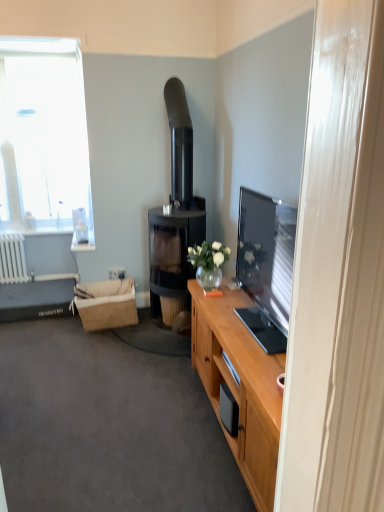
What do you see at coordinates (117, 273) in the screenshot?
I see `white plastic power outlet at lower left` at bounding box center [117, 273].

Locate an element on the screen. burlap picnic basket at lower left is located at coordinates (106, 304).

This screenshot has height=512, width=384. What do you see at coordinates (107, 426) in the screenshot? I see `wooden cabinet at lower right` at bounding box center [107, 426].

This screenshot has height=512, width=384. In order to click on white plastic power outlet at lower left in this screenshot , I will do `click(117, 273)`.

Between white plastic power outlet at lower left and wooden cabinet at lower right, which one has larger size?

wooden cabinet at lower right.

From the picture: From a real-world perspective, is white plastic power outlet at lower left positioned under wooden cabinet at lower right based on gravity?

No, from a real-world perspective, white plastic power outlet at lower left is not below wooden cabinet at lower right.

Is wooden cabinet at lower right at the back of white plastic power outlet at lower left?

No, white plastic power outlet at lower left's orientation is not away from wooden cabinet at lower right.

From the image's perspective, is white plastic power outlet at lower left located beneath burlap picnic basket at lower left?

Actually, white plastic power outlet at lower left appears above burlap picnic basket at lower left in the image.

Which is behind, white plastic power outlet at lower left or burlap picnic basket at lower left?

white plastic power outlet at lower left is further from the camera.

Is wooden cabinet at lower right positioned with its back to white glass window at upper left?

No, wooden cabinet at lower right is not facing away from white glass window at upper left.

Considering the relative positions of wooden cabinet at lower right and white glass window at upper left in the image provided, is wooden cabinet at lower right behind white glass window at upper left?

No, wooden cabinet at lower right is closer to the camera.

Would you consider wooden cabinet at lower right to be distant from white glass window at upper left?

wooden cabinet at lower right is far away from white glass window at upper left.

Can you confirm if white glass window at upper left is taller than black glass fireplace at center?

No.

Is white glass window at upper left to the left of black glass fireplace at center from the viewer's perspective?

Yes, white glass window at upper left is to the left of black glass fireplace at center.

Is point (81, 149) positioned behind point (185, 172)?

Yes, point (81, 149) is behind point (185, 172).

How many degrees apart are the facing directions of white glass window at upper left and black glass fireplace at center?

89.9 degrees separate the facing orientations of white glass window at upper left and black glass fireplace at center.

Can you confirm if white glass window at upper left is positioned to the left of white plastic power outlet at lower left?

Indeed, white glass window at upper left is positioned on the left side of white plastic power outlet at lower left.

Is white glass window at upper left wider than white plastic power outlet at lower left?

Indeed, white glass window at upper left has a greater width compared to white plastic power outlet at lower left.

Consider the image. From the image's perspective, between white glass window at upper left and white plastic power outlet at lower left, who is located below?

white plastic power outlet at lower left appears lower in the image.

How much distance is there between white glass window at upper left and white plastic power outlet at lower left?

white glass window at upper left is 1.56 meters away from white plastic power outlet at lower left.

Who is smaller, burlap picnic basket at lower left or white glass window at upper left?

With smaller size is burlap picnic basket at lower left.

In the image, there is a white glass window at upper left. Where is `picnic basket below it (from a real-world perspective)`? This screenshot has height=512, width=384. picnic basket below it (from a real-world perspective) is located at coordinates (106, 304).

Does burlap picnic basket at lower left appear on the right side of white glass window at upper left?

Yes, burlap picnic basket at lower left is to the right of white glass window at upper left.

Which is behind, point (114, 314) or point (15, 194)?

The point (15, 194) is farther.

Is wooden cabinet at lower right looking in the opposite direction of black glass fireplace at center?

No, wooden cabinet at lower right's orientation is not away from black glass fireplace at center.

Between wooden cabinet at lower right and black glass fireplace at center, which one is positioned behind?

Positioned behind is black glass fireplace at center.

Can you confirm if wooden cabinet at lower right is wider than black glass fireplace at center?

Yes.

Where is `plain that appears on the right of white plastic power outlet at lower left`? Image resolution: width=384 pixels, height=512 pixels. plain that appears on the right of white plastic power outlet at lower left is located at coordinates (107, 426).

Find the location of a particular element. power outlet above the burlap picnic basket at lower left (from the image's perspective) is located at coordinates (117, 273).

In the scene shown: Based on their spatial positions, is wooden cabinet at lower right or white plastic power outlet at lower left further from burlap picnic basket at lower left?

Based on the image, wooden cabinet at lower right appears to be further to burlap picnic basket at lower left.

Which object lies nearer to the anchor point black glass fireplace at center, white plastic power outlet at lower left or wooden cabinet at lower right?

white plastic power outlet at lower left is positioned closer to the anchor black glass fireplace at center.

When comparing their distances from white plastic power outlet at lower left, does wooden cabinet at lower right or white glass window at upper left seem further?

wooden cabinet at lower right.

Based on their spatial positions, is black glass fireplace at center or wooden cabinet at lower right further from burlap picnic basket at lower left?

Based on the image, wooden cabinet at lower right appears to be further to burlap picnic basket at lower left.

When comparing their distances from wooden cabinet at lower right, does white plastic power outlet at lower left or burlap picnic basket at lower left seem closer?

burlap picnic basket at lower left is positioned closer to the anchor wooden cabinet at lower right.

Which object lies further to the anchor point wooden cabinet at lower right, burlap picnic basket at lower left or white glass window at upper left?

white glass window at upper left lies further to wooden cabinet at lower right than the other object.

Looking at the image, which one is located closer to burlap picnic basket at lower left, black glass fireplace at center or white plastic power outlet at lower left?

white plastic power outlet at lower left.

Which object lies further to the anchor point burlap picnic basket at lower left, wooden cabinet at lower right or black glass fireplace at center?

wooden cabinet at lower right is positioned further to the anchor burlap picnic basket at lower left.

Locate an element on the screen. Image resolution: width=384 pixels, height=512 pixels. power outlet between wooden cabinet at lower right and white glass window at upper left from front to back is located at coordinates (117, 273).

This screenshot has height=512, width=384. Identify the location of power outlet between white glass window at upper left and burlap picnic basket at lower left from top to bottom. (117, 273).

This screenshot has width=384, height=512. In order to click on picnic basket between wooden cabinet at lower right and white glass window at upper left from front to back in this screenshot , I will do `click(106, 304)`.

Find the location of a particular element. The image size is (384, 512). picnic basket between wooden cabinet at lower right and white plastic power outlet at lower left from front to back is located at coordinates (106, 304).